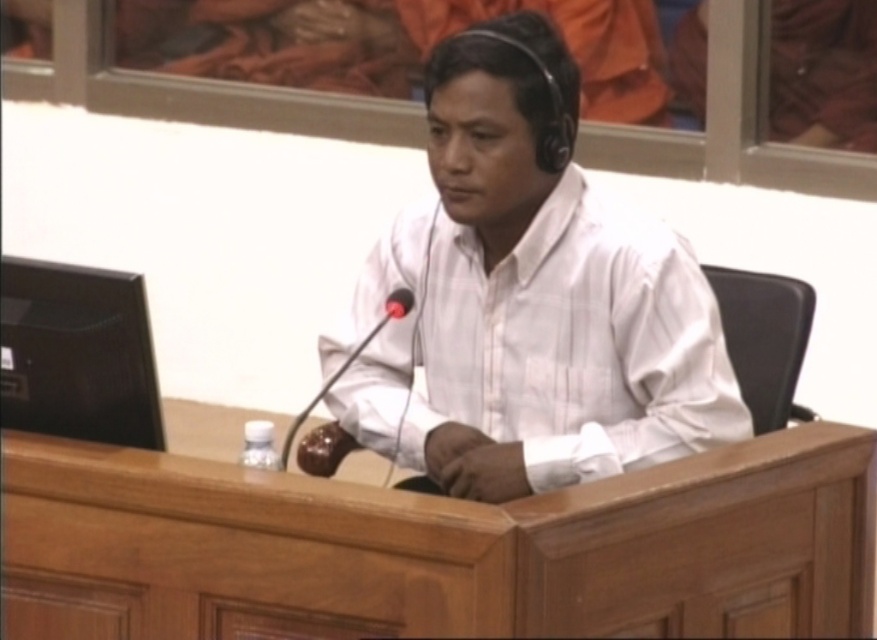
Can you confirm if white matte shirt at center is shorter than brown leather microphone at center?

No, white matte shirt at center is not shorter than brown leather microphone at center.

Does white matte shirt at center appear over brown leather microphone at center?

Correct, white matte shirt at center is located above brown leather microphone at center.

The width and height of the screenshot is (877, 640). I want to click on white matte shirt at center, so click(537, 300).

Who is more forward, [317,490] or [551,81]?

Point [317,490]

Is wooden table at center taller than white matte shirt at center?

No.

Which is behind, point (504, 620) or point (547, 192)?

Positioned behind is point (547, 192).

Image resolution: width=877 pixels, height=640 pixels. I want to click on wooden table at center, so click(x=437, y=548).

Does point (301, 589) lie in front of point (325, 387)?

That is True.

Identify the location of wooden table at center. (437, 548).

Where is `wooden table at center`? This screenshot has width=877, height=640. wooden table at center is located at coordinates (437, 548).